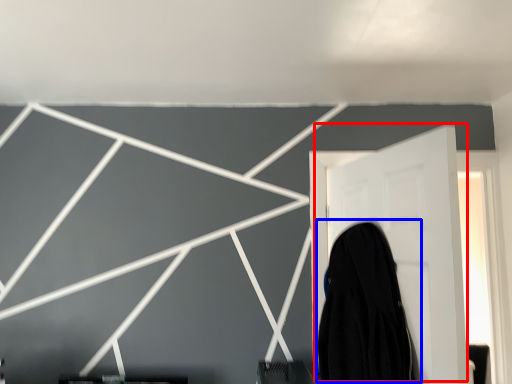
Question: Which of the following is the closest to the observer, door (highlighted by a red box) or garment (highlighted by a blue box)?

Choices:
 (A) door
 (B) garment

Answer: (A)